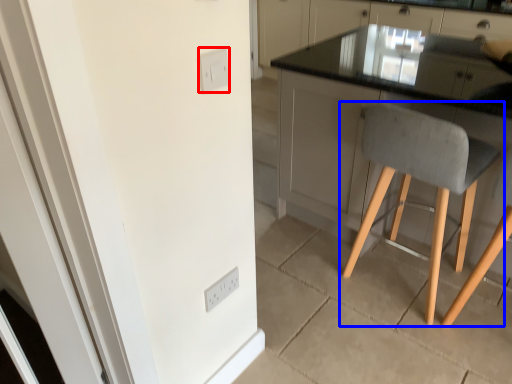
Question: Which object is closer to the camera taking this photo, light switch (highlighted by a red box) or chair (highlighted by a blue box)?

Choices:
 (A) light switch
 (B) chair

Answer: (A)